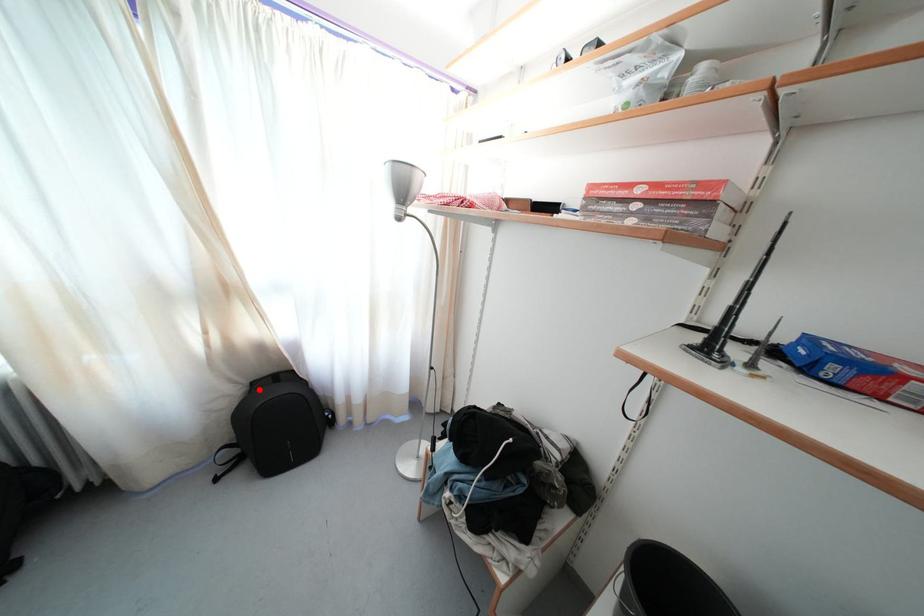
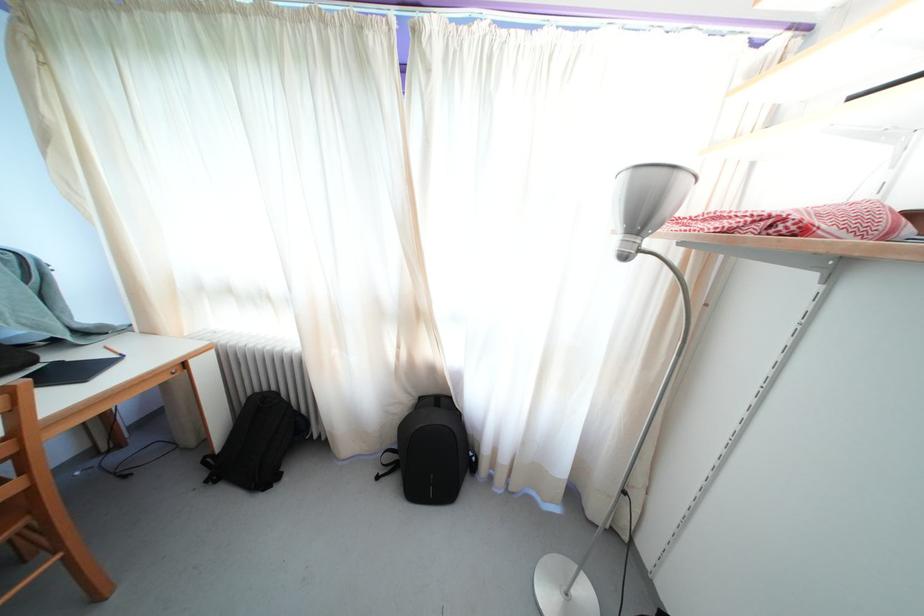
Question: I am providing you with two images of the same scene from different viewpoints. Given a red point in image1, look at the same physical point in image2. Is it:

Choices:
 (A) Closer to the viewpoint
 (B) Farther from the viewpoint

Answer: (B)